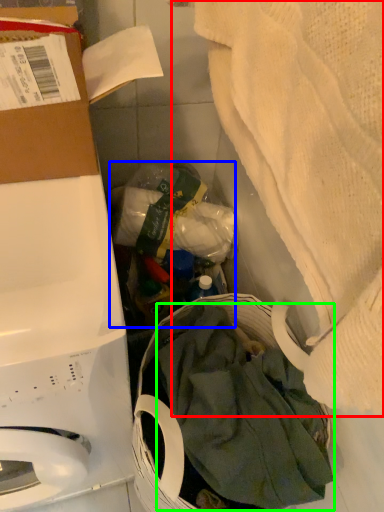
Question: Based on their relative distances, which object is nearer to blanket (highlighted by a red box)? Choose from garbage (highlighted by a blue box) and clothing (highlighted by a green box).

Choices:
 (A) garbage
 (B) clothing

Answer: (B)